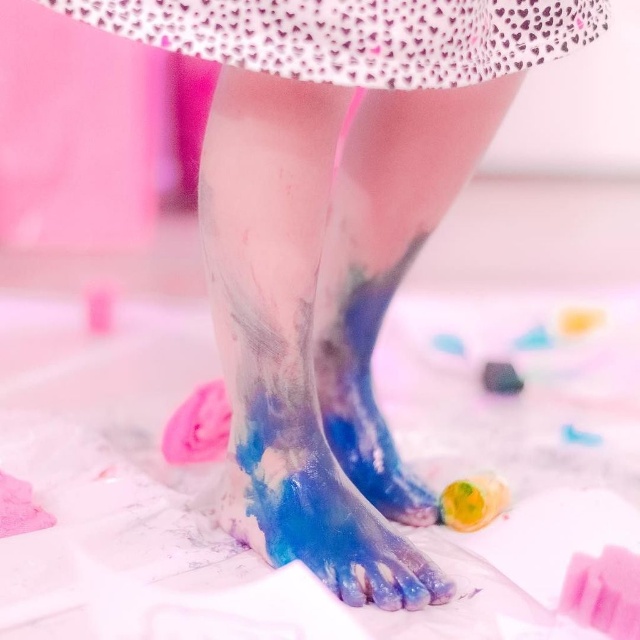
You are an artist observing the scene. You notice the white dotted fabric at upper center and the shiny blue paint at lower center. Which object occupies a bigger area in the image?

The white dotted fabric at upper center has a larger size compared to the shiny blue paint at lower center, so it occupies a bigger area in the image.

You are an artist observing the scene. You notice the white dotted fabric at upper center and the blue glossy foot at center. Which object is located to the left of the other?

The white dotted fabric at upper center is positioned on the left side of blue glossy foot at center.